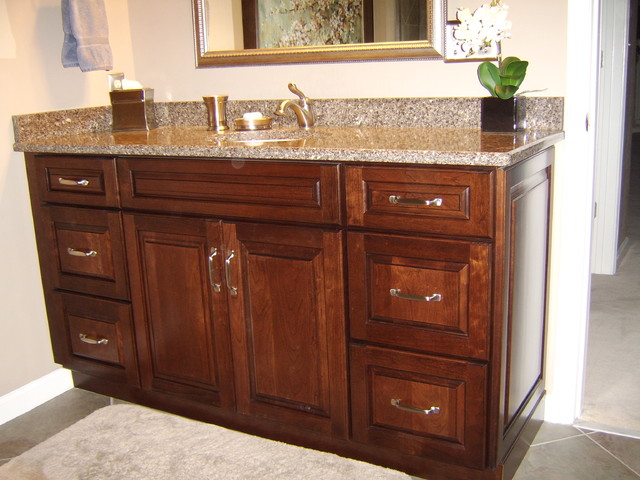
This screenshot has width=640, height=480. I want to click on bathroom mat, so click(166, 437).